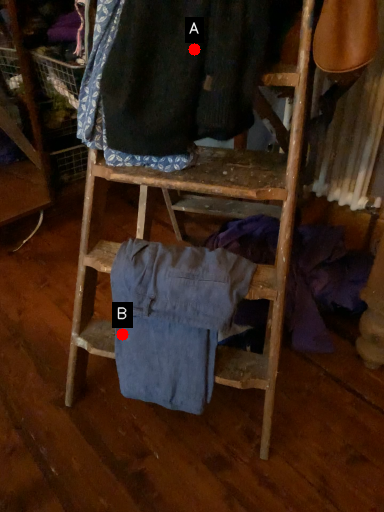
Question: Two points are circled on the image, labeled by A and B beside each circle. Among these points, which one is nearest to the camera?

Choices:
 (A) A is closer
 (B) B is closer

Answer: (A)